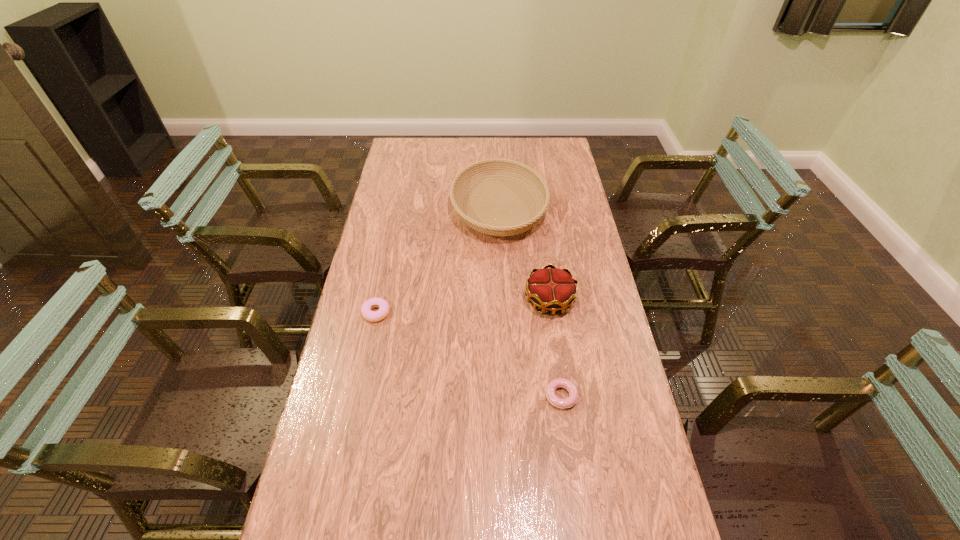
The image size is (960, 540). In order to click on basket in this screenshot , I will do `click(498, 168)`.

The image size is (960, 540). In order to click on crown in this screenshot , I will do `click(552, 289)`.

Find the location of `the taller doughnut`. the taller doughnut is located at coordinates (374, 316).

At what (x,y) coordinates should I click in order to perform the action: click on the left doughnut. Please return your answer as a coordinate pair (x, y). The width and height of the screenshot is (960, 540). Looking at the image, I should click on (374, 316).

The width and height of the screenshot is (960, 540). What are the coordinates of `the right doughnut` in the screenshot? It's located at (560, 382).

I want to click on the nearer doughnut, so click(x=560, y=382).

Where is `vacant space located on the right of the basket`? The width and height of the screenshot is (960, 540). vacant space located on the right of the basket is located at coordinates (564, 209).

Find the location of a particular element. This screenshot has height=540, width=960. free spot located 0.070m on the back of the crown is located at coordinates (544, 267).

Locate an element on the screen. vacant space located 0.200m on the front of the taller doughnut is located at coordinates (362, 381).

Where is `vacant space located on the right of the nearer doughnut`? vacant space located on the right of the nearer doughnut is located at coordinates (614, 396).